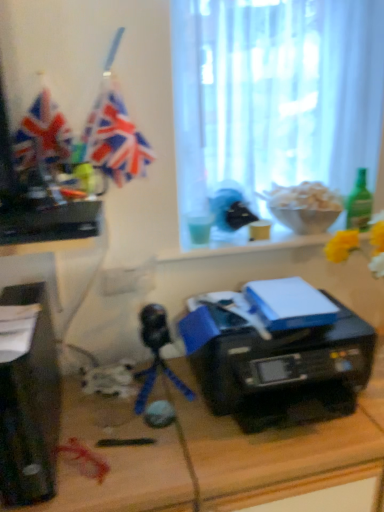
You are a GUI agent. You are given a task and a screenshot of the screen. Output one action in this format:
    pyautogui.click(x=<x>, y=<y>)
    Task: Click on the black plastic printer at center
    
    Given the screenshot: What is the action you would take?
    pyautogui.click(x=282, y=451)

In order to face black plastic desktop computer at left, should I rotate leftwards or rightwards?

To face it directly, rotate left by 20.943 degrees.

Measure the distance between point (142,165) and camera.

1.13 meters.

Describe the element at coordinates (359, 203) in the screenshot. I see `green glass bottle at right` at that location.

Describe the element at coordinates (277, 353) in the screenshot. I see `black plastic printer at center` at that location.

What do you see at coordinates (274, 95) in the screenshot? The image size is (384, 512). I see `white sheer curtain at upper center` at bounding box center [274, 95].

This screenshot has height=512, width=384. Find the location of `translucent plastic cup at window`. translucent plastic cup at window is located at coordinates (199, 227).

Does black plastic printer at center have a greater width compared to green glass bottle at right?

Indeed, black plastic printer at center has a greater width compared to green glass bottle at right.

Does point (130, 490) come in front of point (369, 201)?

Yes, point (130, 490) is closer to viewer.

Is black plastic printer at center bigger or smaller than green glass bottle at right?

In the image, black plastic printer at center appears to be larger than green glass bottle at right.

Is black plastic printer at center placed right next to green glass bottle at right?

No, black plastic printer at center is not touching green glass bottle at right.

Image resolution: width=384 pixels, height=512 pixels. Identify the location of desktop computer that appears in front of the green glass bottle at right. (30, 407).

From the image's perspective, would you say black plastic desktop computer at left is positioned over green glass bottle at right?

Incorrect, from the image's perspective, black plastic desktop computer at left is lower than green glass bottle at right.

How different are the orientations of black plastic desktop computer at left and green glass bottle at right in degrees?

The angular difference between black plastic desktop computer at left and green glass bottle at right is 3.51 degrees.

Can you confirm if black plastic desktop computer at left is positioned to the right of green glass bottle at right?

No, black plastic desktop computer at left is not to the right of green glass bottle at right.

Consider the image. Which object is wider, translucent plastic cup at window or black plastic printer at center?

Wider between the two is black plastic printer at center.

Is translucent plastic cup at window oriented towards black plastic printer at center?

No, translucent plastic cup at window is not aimed at black plastic printer at center.

Does translucent plastic cup at window lie in front of black plastic printer at center?

That is False.

Can you tell me how much matte plastic flag at upper left and black plastic desktop computer at left differ in facing direction?

They differ by 1.32 degrees in their facing directions.

Is matte plastic flag at upper left bigger than black plastic desktop computer at left?

Actually, matte plastic flag at upper left might be smaller than black plastic desktop computer at left.

From the image's perspective, is matte plastic flag at upper left located above or below black plastic desktop computer at left?

matte plastic flag at upper left is above black plastic desktop computer at left.

Is point (112, 164) closer or farther from the camera than point (41, 424)?

Point (112, 164) is positioned farther from the camera compared to point (41, 424).

Is white sheer curtain at upper center in front of black plastic printer at center?

No, white sheer curtain at upper center is further to the viewer.

Considering the sizes of objects white sheer curtain at upper center and black plastic printer at center in the image provided, who is thinner, white sheer curtain at upper center or black plastic printer at center?

With smaller width is white sheer curtain at upper center.

From the image's perspective, is white sheer curtain at upper center on black plastic printer at center?

Yes, from the image's perspective, white sheer curtain at upper center is above black plastic printer at center.

Would you say white sheer curtain at upper center is a long distance from black plastic printer at center?

That's not correct — white sheer curtain at upper center is a little close to black plastic printer at center.

Is white sheer curtain at upper center positioned before black plastic desktop computer at left?

No, it is behind black plastic desktop computer at left.

Could you tell me if white sheer curtain at upper center is facing black plastic desktop computer at left?

No, white sheer curtain at upper center is not turned towards black plastic desktop computer at left.

You are a GUI agent. You are given a task and a screenshot of the screen. Output one action in this format:
    pyautogui.click(x=<x>, y=<y>)
    Task: Click on the desktop computer below the white sheer curtain at upper center (from the image's perspective)
    This screenshot has width=384, height=512.
    Given the screenshot: What is the action you would take?
    pyautogui.click(x=30, y=407)

Which is correct: white sheer curtain at upper center is inside black plastic desktop computer at left, or outside of it?

white sheer curtain at upper center is not enclosed by black plastic desktop computer at left.

From the picture: From the image's perspective, is black plastic printer at center above black plastic printer at center?

Yes, from the image's perspective, black plastic printer at center is above black plastic printer at center.

The image size is (384, 512). Identify the location of desk on the left of black plastic printer at center. (282, 451).

From a real-world perspective, is black plastic printer at center positioned under black plastic printer at center based on gravity?

Actually, black plastic printer at center is physically above black plastic printer at center in the real world.

The width and height of the screenshot is (384, 512). I want to click on bottle on the right of black plastic printer at center, so (x=359, y=203).

The width and height of the screenshot is (384, 512). Identify the location of bottle behind the black plastic desktop computer at left. (359, 203).

From the image, which object appears to be farther from green glass bottle at right, matte plastic flag at upper left or white sheer curtain at upper center?

Among the two, matte plastic flag at upper left is located further to green glass bottle at right.

Estimate the real-world distances between objects in this image. Which object is further from translucent plastic cup at window, green glass bottle at right or black plastic printer at center?

The object further to translucent plastic cup at window is green glass bottle at right.

From the image, which object appears to be nearer to green glass bottle at right, matte plastic flag at upper left or black plastic printer at center?

black plastic printer at center is positioned closer to the anchor green glass bottle at right.

Based on their spatial positions, is black plastic desktop computer at left or translucent plastic cup at window further from white sheer curtain at upper center?

black plastic desktop computer at left is further to white sheer curtain at upper center.

Which object lies further to the anchor point green glass bottle at right, white sheer curtain at upper center or black plastic desktop computer at left?

black plastic desktop computer at left is further to green glass bottle at right.

From the image, which object appears to be nearer to black plastic printer at center, black plastic printer at center or matte plastic flag at upper left?

black plastic printer at center.

Based on their spatial positions, is translucent plastic cup at window or black plastic printer at center further from green glass bottle at right?

black plastic printer at center is positioned further to the anchor green glass bottle at right.

When comparing their distances from matte plastic flag at upper left, does black plastic printer at center or white sheer curtain at upper center seem closer?

white sheer curtain at upper center is positioned closer to the anchor matte plastic flag at upper left.

Identify the location of printer between translucent plastic cup at window and black plastic printer at center in the vertical direction. point(277,353).

Locate an element on the screen. printer between white sheer curtain at upper center and black plastic printer at center in the up-down direction is located at coordinates (277, 353).

The height and width of the screenshot is (512, 384). Identify the location of printer between black plastic desktop computer at left and green glass bottle at right in the horizontal direction. (277, 353).

Locate an element on the screen. The image size is (384, 512). coffee cup between matte plastic flag at upper left and green glass bottle at right from left to right is located at coordinates (199, 227).